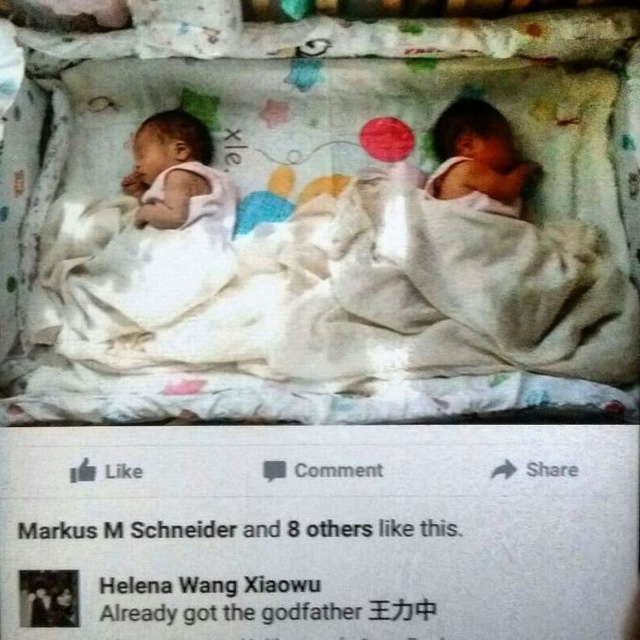
You are a parent looking at this image of your baby. You want to check if the white soft blanket at center is positioned exactly at the center of the crib. Based on the coordinates provided, is the blanket at the center?

The 2D location of the white soft blanket at center is at point (328, 228). Since the center of the crib would be at coordinates (320, 320), the blanket is slightly to the left and slightly below the exact center.

You are a parent holding a baby and want to cover them completely with the white soft blanket at center. Given that the smooth skin newborn at right is 20 inches long, can the blanket cover the baby entirely?

The distance between the white soft blanket at center and the smooth skin newborn at right is 7.76 inches. Since the baby is 20 inches long, the blanket may not be large enough to fully cover the baby as the available space between them is less than the baby length.

You are holding a camera and want to take a photo of the two babies in the crib. The camera is currently at a position that is 38.28 inches away from the point labeled as point (x=609, y=42). If you want to ensure that both babies are fully visible in the photo, should you move the camera closer or farther away from the crib?

The camera is 38.28 inches away from the point labeled as point (x=609, y=42). To ensure both babies are fully visible in the photo, you should move the camera farther away from the crib. Moving farther would allow the camera to capture a wider angle, ensuring both babies are included in the frame.